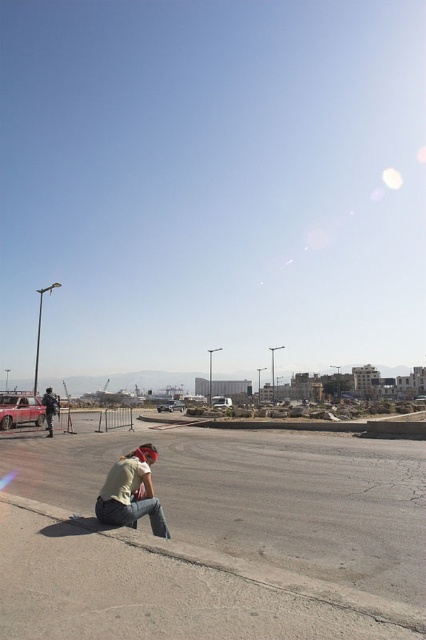
Question: Among these objects, which one is farthest from the camera?

Choices:
 (A) metallic silver truck at center
 (B) denim jeans at lower left
 (C) metallic silver car at center

Answer: (C)

Question: From the image, what is the correct spatial relationship of matte black jacket at lower left in relation to metallic silver car at center?

Choices:
 (A) below
 (B) above

Answer: (B)

Question: Can you confirm if metallic silver car at center is wider than metallic silver truck at center?

Choices:
 (A) yes
 (B) no

Answer: (A)

Question: Is matte black jacket at lower left behind metallic silver truck at center?

Choices:
 (A) no
 (B) yes

Answer: (A)

Question: Which point is closer to the camera?

Choices:
 (A) smooth concrete pavement at lower left
 (B) matte black jacket at lower left
 (C) metallic silver car at center

Answer: (A)

Question: Which point is farther to the camera?

Choices:
 (A) metallic silver truck at center
 (B) denim jeans at lower left
 (C) smooth concrete pavement at lower left
 (D) rustic red car at lower left

Answer: (A)